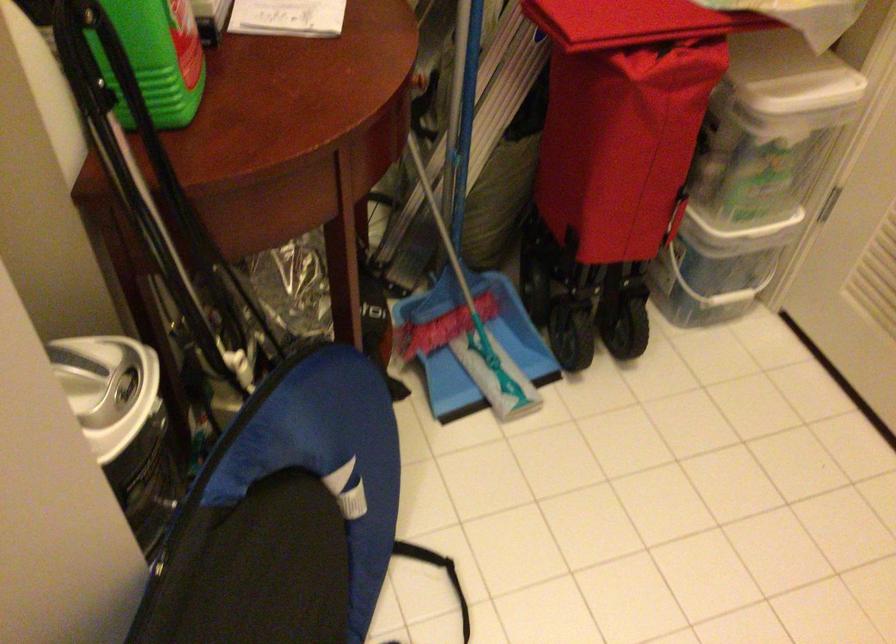
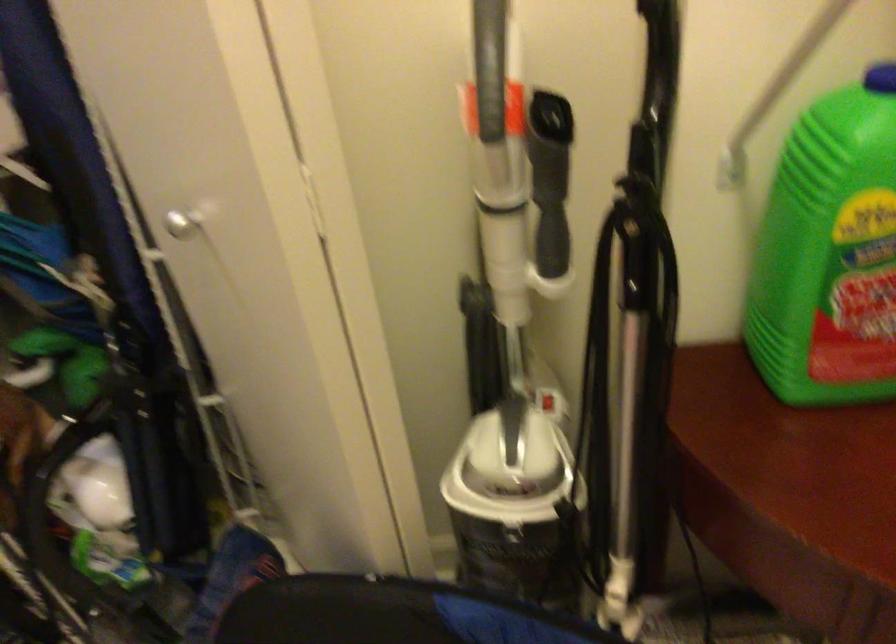
Based on the continuous images, in which direction is the camera rotating?

The rotation direction of the camera is left-down.